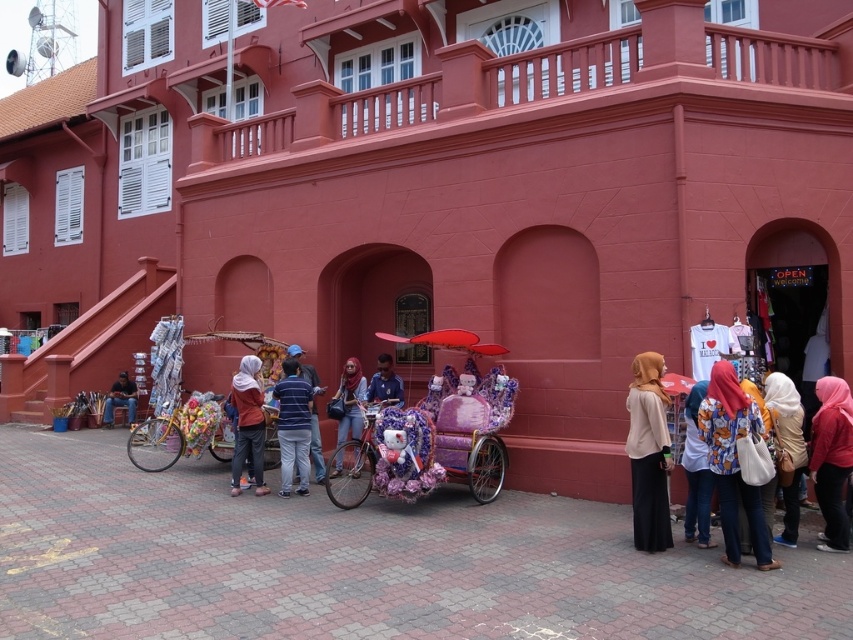
You are standing at the center of the street in front of the red building. You see a point marked at coordinates (733, 461). What object does this point correspond to?

The point corresponds to the printed fabric headscarf at lower right.

You are a tourist standing in front of the red building and want to take a photo of the red matte umbrella at center and the matte black bicycle at lower left. Which object should you focus on first to ensure both are in the frame?

You should focus on the matte black bicycle at lower left first because the red matte umbrella at center is in front of it, ensuring both will be visible in the frame.